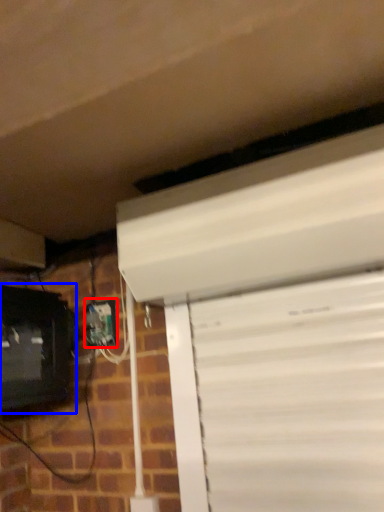
Question: Among these objects, which one is farthest to the camera, electric outlet (highlighted by a red box) or computer monitor (highlighted by a blue box)?

Choices:
 (A) electric outlet
 (B) computer monitor

Answer: (A)